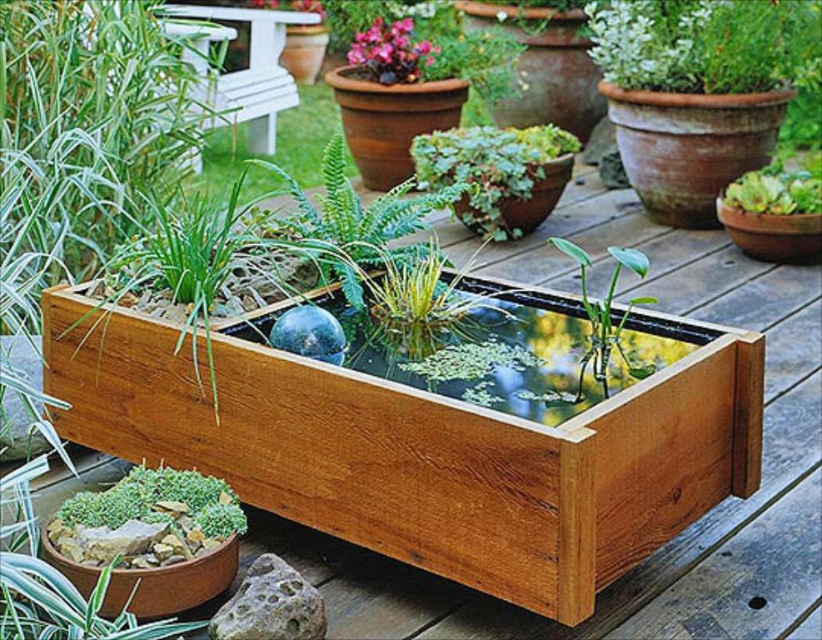
Is green succulent at lower left to the right of matte terracotta pot at upper center from the viewer's perspective?

In fact, green succulent at lower left is to the left of matte terracotta pot at upper center.

Which is above, green succulent at lower left or matte terracotta pot at upper center?

Positioned higher is matte terracotta pot at upper center.

Locate an element on the screen. The image size is (822, 640). green succulent at lower left is located at coordinates (158, 502).

Who is more distant from viewer, (111, 509) or (607, 355)?

Point (607, 355)

Which is behind, point (95, 506) or point (597, 360)?

The point (597, 360) is behind.

Identify the location of green succulent at lower left. Image resolution: width=822 pixels, height=640 pixels. (158, 502).

Who is lower down, wooden fish pond at center or green glossy leafy plant at center?

Positioned lower is wooden fish pond at center.

Which is more to the left, wooden fish pond at center or green glossy leafy plant at center?

From the viewer's perspective, wooden fish pond at center appears more on the left side.

I want to click on wooden fish pond at center, so click(x=497, y=349).

This screenshot has height=640, width=822. In order to click on wooden fish pond at center in this screenshot , I will do `click(497, 349)`.